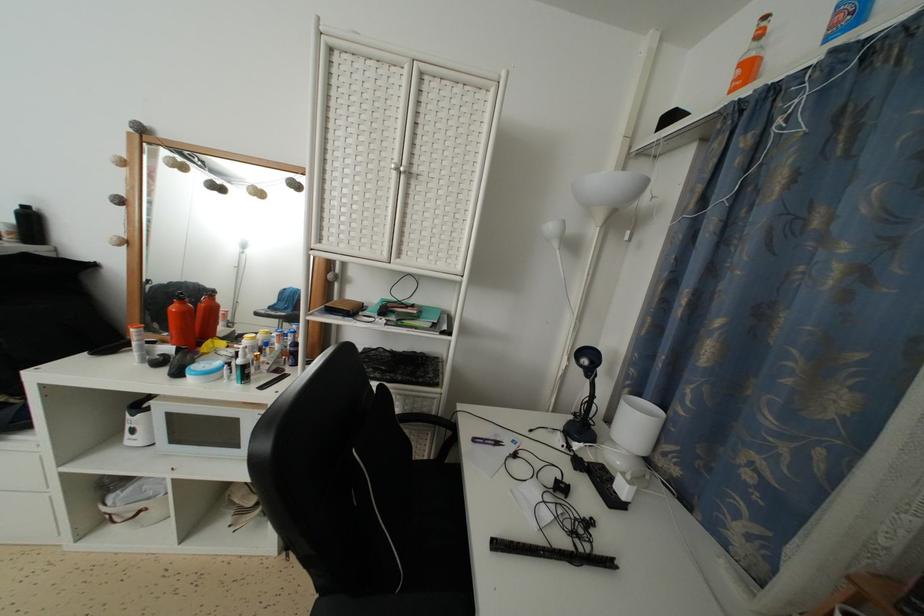
At what (x,y) coordinates should I click in order to perform the action: click on white cylindrical cup. Please return your answer as a coordinate pair (x, y). Looking at the image, I should click on (637, 424).